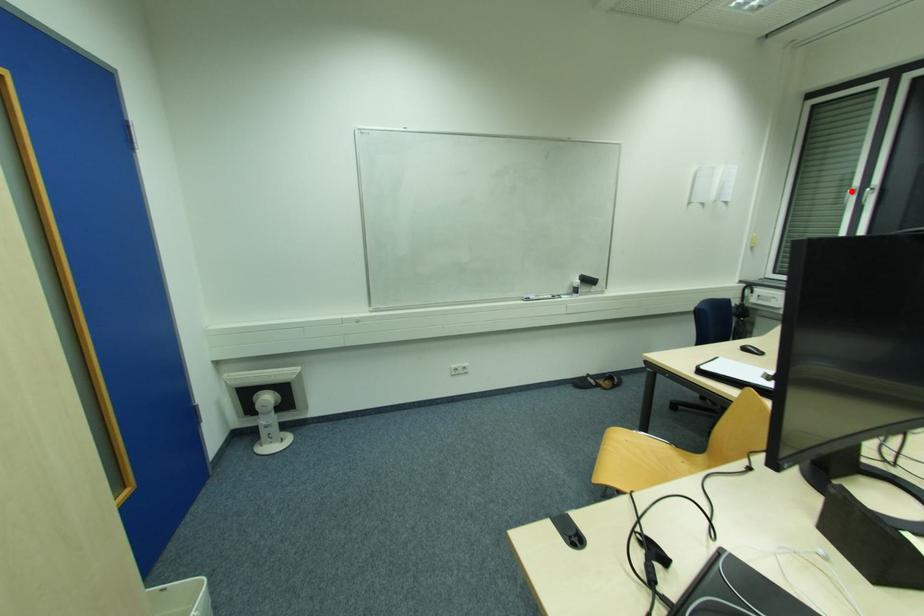
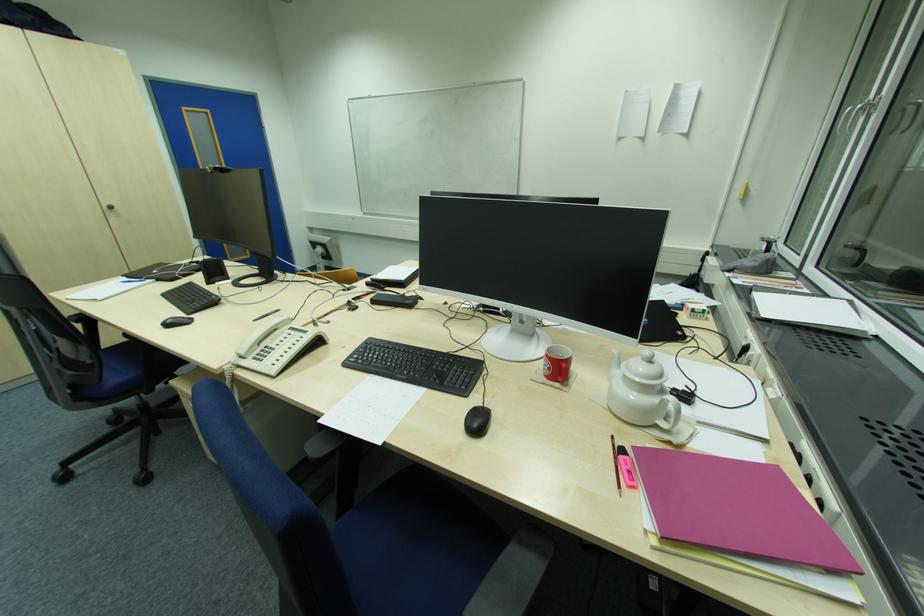
Where in the second image is the point corresponding to the highlighted location from the first image?

(850, 111)